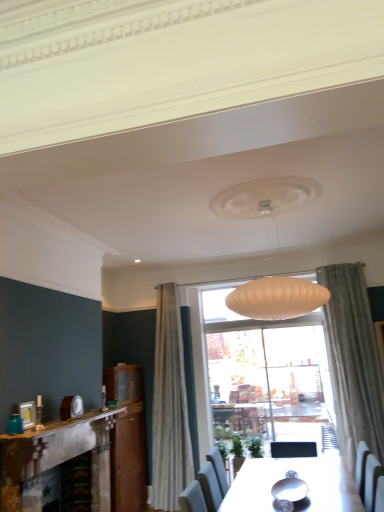
Question: Is white marble fireplace at lower left completely or partially inside rustic stone fireplace at left?

Choices:
 (A) yes
 (B) no

Answer: (B)

Question: Is rustic stone fireplace at left to the left of white marble fireplace at lower left from the viewer's perspective?

Choices:
 (A) yes
 (B) no

Answer: (A)

Question: Considering the relative sizes of rustic stone fireplace at left and white marble fireplace at lower left in the image provided, is rustic stone fireplace at left wider than white marble fireplace at lower left?

Choices:
 (A) no
 (B) yes

Answer: (B)

Question: Is rustic stone fireplace at left thinner than white marble fireplace at lower left?

Choices:
 (A) no
 (B) yes

Answer: (A)

Question: Could you tell me if rustic stone fireplace at left is turned towards white marble fireplace at lower left?

Choices:
 (A) yes
 (B) no

Answer: (B)

Question: In terms of width, does white marble fireplace at lower left look wider or thinner when compared to teal glass jar at left?

Choices:
 (A) thin
 (B) wide

Answer: (B)

Question: Which is correct: white marble fireplace at lower left is inside teal glass jar at left, or outside of it?

Choices:
 (A) outside
 (B) inside

Answer: (A)

Question: From the image's perspective, is white marble fireplace at lower left located above or below teal glass jar at left?

Choices:
 (A) below
 (B) above

Answer: (A)

Question: In terms of size, does white marble fireplace at lower left appear bigger or smaller than teal glass jar at left?

Choices:
 (A) small
 (B) big

Answer: (B)

Question: Based on their positions, is teal glass jar at left located to the left or right of rustic stone fireplace at left?

Choices:
 (A) left
 (B) right

Answer: (A)

Question: From a real-world perspective, is teal glass jar at left above or below rustic stone fireplace at left?

Choices:
 (A) below
 (B) above

Answer: (B)

Question: Is teal glass jar at left wider or thinner than rustic stone fireplace at left?

Choices:
 (A) thin
 (B) wide

Answer: (A)

Question: From their relative heights in the image, would you say teal glass jar at left is taller or shorter than rustic stone fireplace at left?

Choices:
 (A) tall
 (B) short

Answer: (B)

Question: Is teal glass jar at left inside or outside of white marble fireplace at lower left?

Choices:
 (A) outside
 (B) inside

Answer: (A)

Question: Considering the positions of teal glass jar at left and white marble fireplace at lower left in the image, is teal glass jar at left wider or thinner than white marble fireplace at lower left?

Choices:
 (A) wide
 (B) thin

Answer: (B)